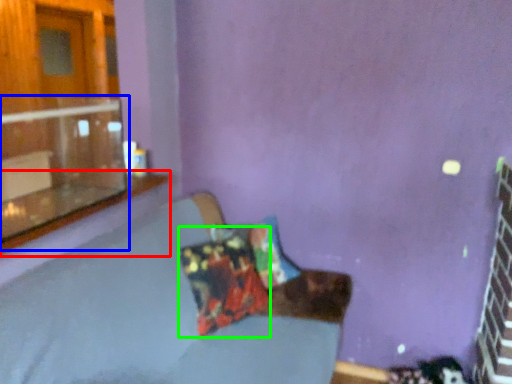
Question: Which is nearer to the window sill (highlighted by a red box)? window (highlighted by a blue box) or pillow (highlighted by a green box).

Choices:
 (A) window
 (B) pillow

Answer: (A)